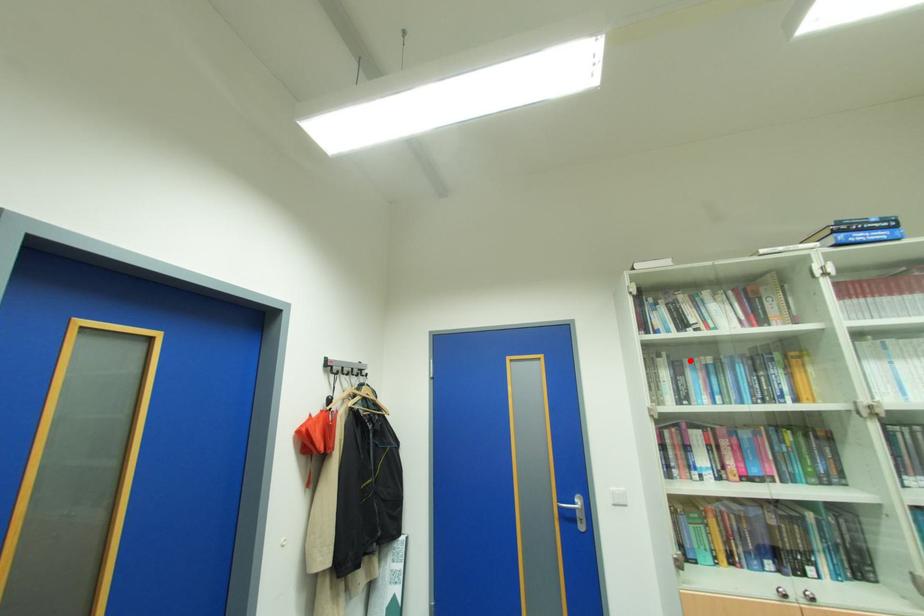
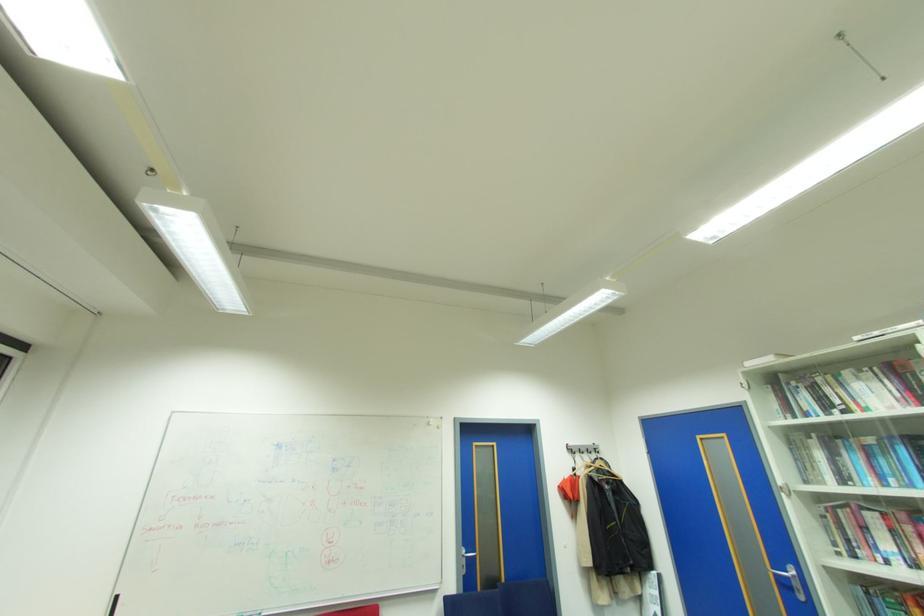
Find the pixel in the second image that matches the highlighted location in the first image.

(843, 442)